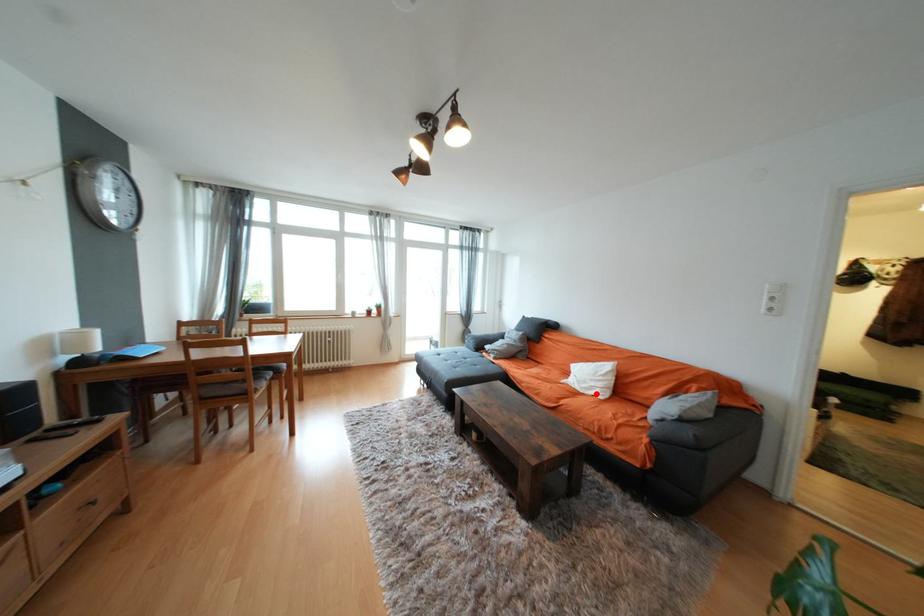
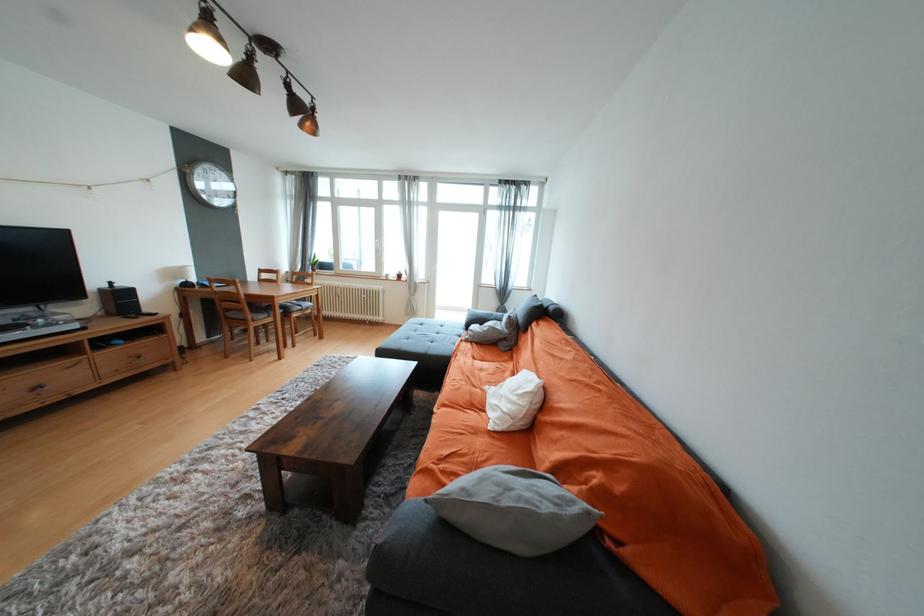
Find the pixel in the second image that matches the highlighted location in the first image.

(496, 416)